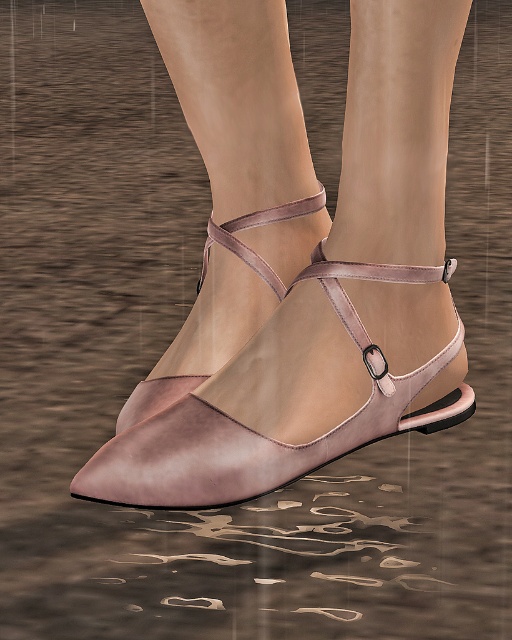
You are a fashion designer examining the image of a pair of shoes. You notice the matte leather sandal at center and the matte pink leather strap at center. Which object is located below the other?

The matte leather sandal at center is positioned under the matte pink leather strap at center.

Looking at this image, you are a fashion designer observing the image of the matte pink leather shoe at center and the matte pink leather strap at center. Which object is closer to the viewer?

The matte pink leather shoe at center is closer to the viewer than the matte pink leather strap at center.

You are a fashion designer observing the image of the shoes. You need to determine the spatial relationship between the matte leather sandal at center and the matte pink leather strap at center. Which object is located to the right of the other?

The matte leather sandal at center is positioned on the right side of matte pink leather strap at center.